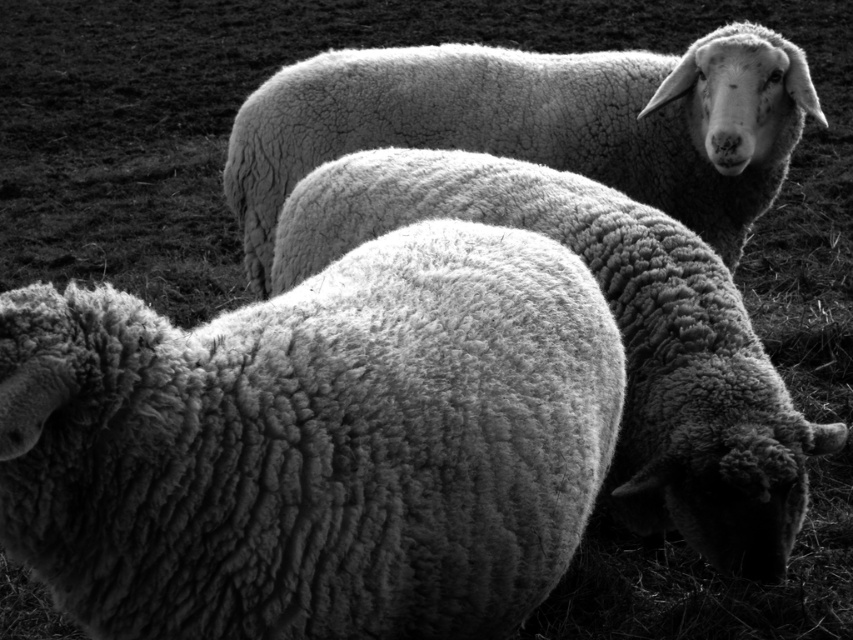
Based on the scene description, where is the fuzzy woolly sheep at center located in terms of its 2D coordinates?

The fuzzy woolly sheep at center is located at the 2D coordinates of point (314, 444).

You are standing in front of the black and white photograph of the three sheep. There is a point at coordinates point (456, 435) that you want to touch. If your hand is 1.5 meters away from the photograph, will your finger reach the point?

The point (456, 435) is 1.55 meters from the camera. Since your hand is 1.5 meters away from the photograph, your finger will not reach the point because it is slightly farther away than your hand.